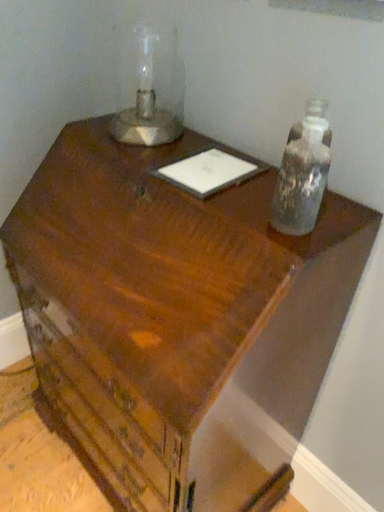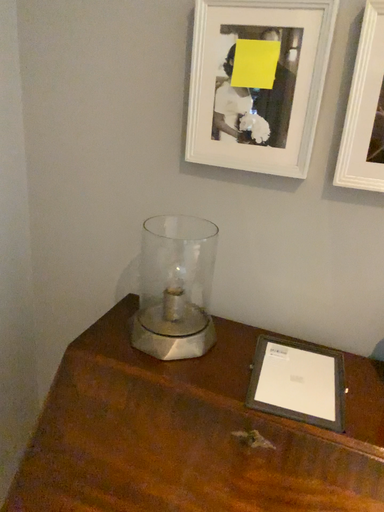
Question: How did the camera likely rotate when shooting the video?

Choices:
 (A) rotated downward
 (B) rotated upward

Answer: (B)